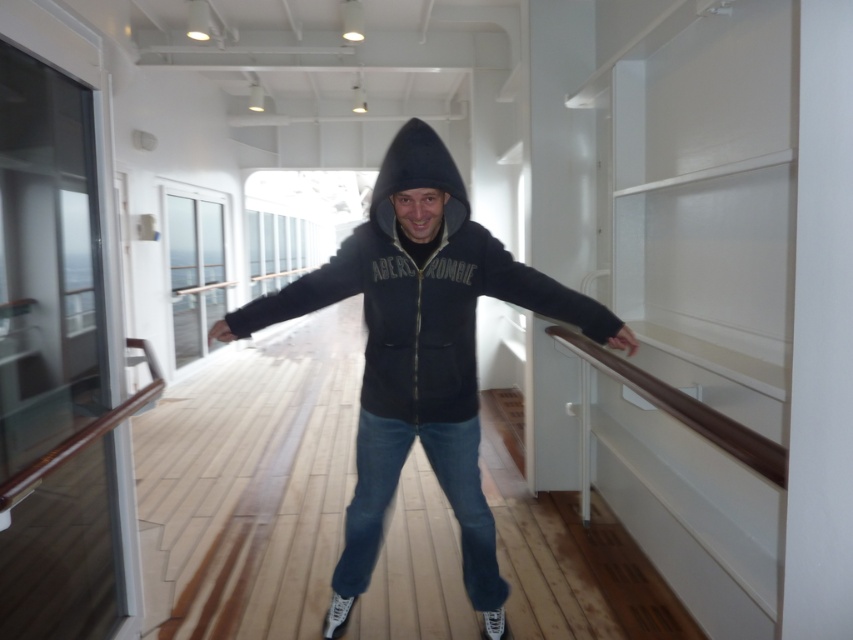
Does black cotton hoodie at center appear under black fleece hoodie at center?

Yes.

Does black cotton hoodie at center have a larger size compared to black fleece hoodie at center?

Indeed, black cotton hoodie at center has a larger size compared to black fleece hoodie at center.

Is point (427, 264) in front of point (430, 176)?

No, it is behind (430, 176).

Where is `black cotton hoodie at center`? black cotton hoodie at center is located at coordinates (421, 353).